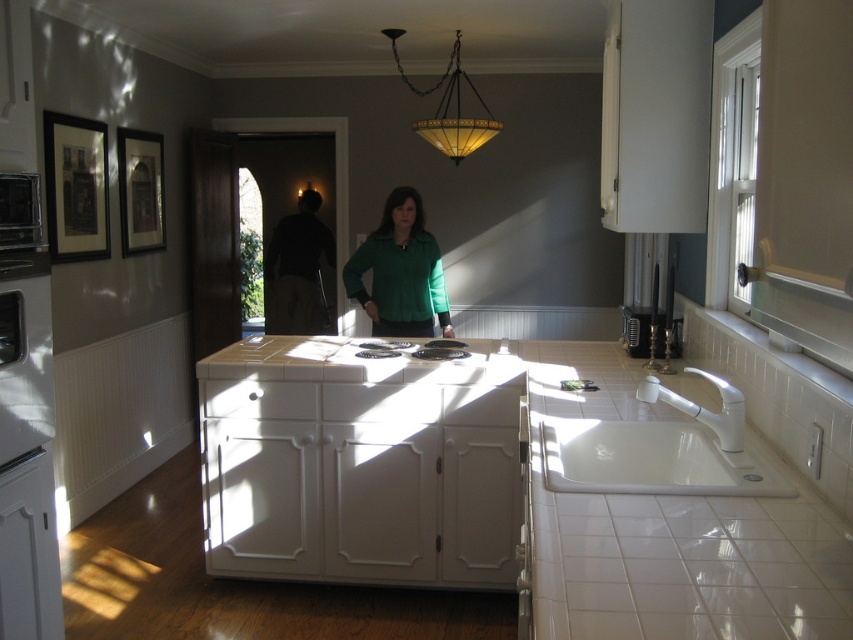
This screenshot has width=853, height=640. What do you see at coordinates (399, 273) in the screenshot?
I see `green matte shirt at center` at bounding box center [399, 273].

Is point (376, 275) positioned behind point (306, 259)?

No, (376, 275) is closer to viewer.

Locate an element on the screen. The width and height of the screenshot is (853, 640). green matte shirt at center is located at coordinates (399, 273).

Which of these two, white tile countertop at center or tinted glass chandelier at upper center, stands shorter?

tinted glass chandelier at upper center is shorter.

Which is in front, point (479, 397) or point (456, 65)?

Point (479, 397) is in front.

At what (x,y) coordinates should I click in order to perform the action: click on white tile countertop at center. Please return your answer as a coordinate pair (x, y). Image resolution: width=853 pixels, height=640 pixels. Looking at the image, I should click on (503, 493).

Can you confirm if white tile countertop at center is positioned above white ceramic sink at lower right?

Actually, white tile countertop at center is below white ceramic sink at lower right.

Can you confirm if white tile countertop at center is positioned below white ceramic sink at lower right?

Indeed, white tile countertop at center is positioned under white ceramic sink at lower right.

Between point (724, 625) and point (711, 449), which one is positioned in front?

Point (724, 625)

This screenshot has width=853, height=640. I want to click on white tile countertop at center, so click(x=503, y=493).